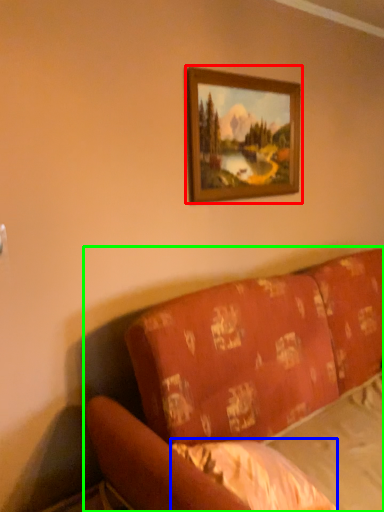
Question: Based on their relative distances, which object is farther from picture frame (highlighted by a red box)? Choose from sheet (highlighted by a blue box) and studio couch (highlighted by a green box).

Choices:
 (A) sheet
 (B) studio couch

Answer: (A)